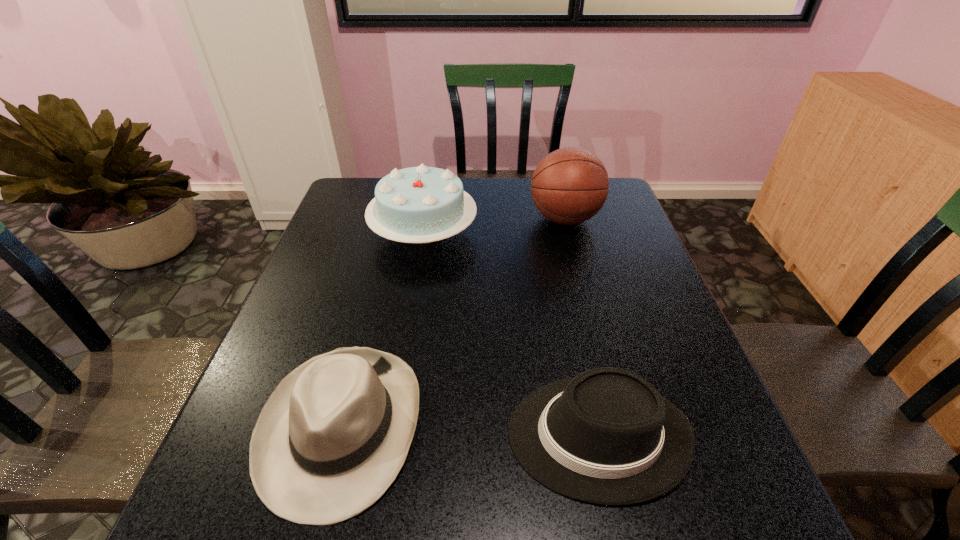
The image size is (960, 540). I want to click on birthday cake present at the far edge, so click(422, 204).

Locate an element on the screen. birthday cake at the left edge is located at coordinates (422, 204).

Locate an element on the screen. The height and width of the screenshot is (540, 960). fedora that is at the left edge is located at coordinates (330, 440).

Image resolution: width=960 pixels, height=540 pixels. Find the location of `basketball positioned at the right edge`. basketball positioned at the right edge is located at coordinates (569, 186).

Locate an element on the screen. Image resolution: width=960 pixels, height=540 pixels. fedora located in the right edge section of the desktop is located at coordinates (607, 436).

Find the location of a particular element. object at the far left corner is located at coordinates (422, 204).

I want to click on object positioned at the near left corner, so click(330, 440).

Locate an element on the screen. object that is at the far right corner is located at coordinates (569, 186).

The image size is (960, 540). Identify the location of object positioned at the near right corner. (607, 436).

At what (x,y) coordinates should I click in order to perform the action: click on vacant space at the far edge. Please return your answer as a coordinate pair (x, y). Looking at the image, I should click on (479, 185).